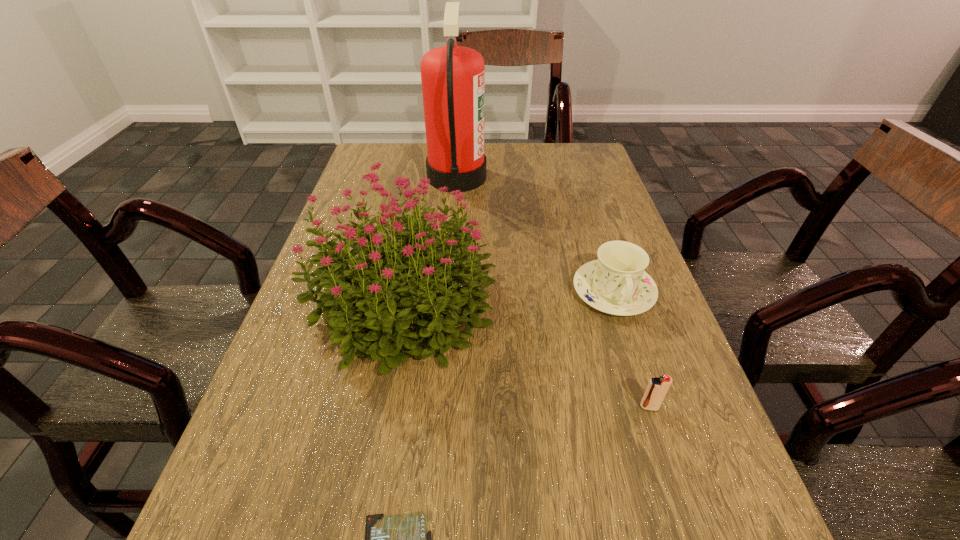
Find the location of a particular element. This screenshot has width=960, height=540. free space that is in between the third tallest object and the fire extinguisher is located at coordinates (536, 234).

Locate an element on the screen. vacant area between the fire extinguisher and the igniter is located at coordinates (553, 292).

I want to click on object identified as the closest to the bouquet, so click(616, 283).

Identify which object is located as the fourth nearest to the igniter. Please provide its 2D coordinates. Your answer should be formatted as a tuple, i.e. [(x, y)], where the tuple contains the x and y coordinates of a point satisfying the conditions above.

[(453, 77)]

Where is `blank space that satisfies the following two spatial constraints: 1. at the nozzle of the igniter; 2. on the left side of the farthest object`? The image size is (960, 540). blank space that satisfies the following two spatial constraints: 1. at the nozzle of the igniter; 2. on the left side of the farthest object is located at coordinates (439, 407).

Identify the location of free location that satisfies the following two spatial constraints: 1. on the back side of the igniter; 2. at the nozzle of the farthest object. This screenshot has height=540, width=960. (575, 177).